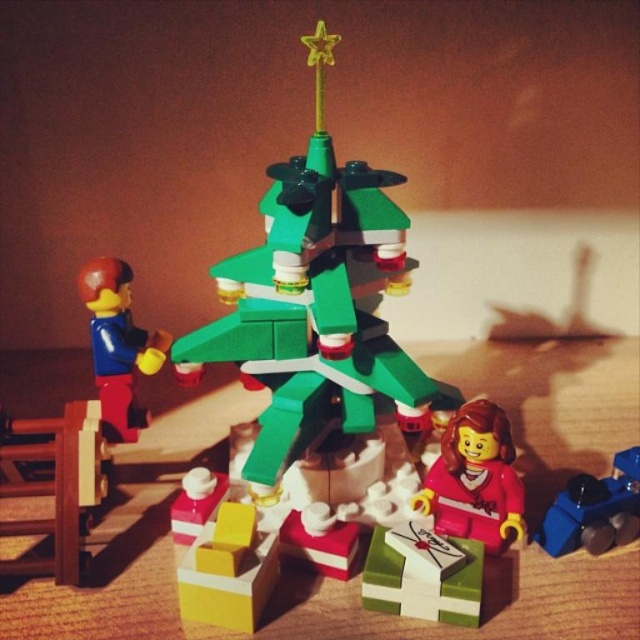
Question: Is green matte christmas tree at center bigger than smooth red minifigure at center?

Choices:
 (A) yes
 (B) no

Answer: (A)

Question: Which object is closer to the camera taking this photo?

Choices:
 (A) matte blue plastic figure at left
 (B) green matte gift at center
 (C) smooth red minifigure at center
 (D) blue plastic train at lower right

Answer: (B)

Question: Can you confirm if smooth red minifigure at center is positioned above green matte gift at center?

Choices:
 (A) yes
 (B) no

Answer: (A)

Question: In this image, where is green matte gift at center located relative to blue plastic train at lower right?

Choices:
 (A) below
 (B) above

Answer: (A)

Question: Which is farther from the smooth red minifigure at center?

Choices:
 (A) green matte gift at center
 (B) green matte christmas tree at center
 (C) matte blue plastic figure at left
 (D) blue plastic train at lower right

Answer: (C)

Question: Among these points, which one is nearest to the camera?

Choices:
 (A) (388, 230)
 (B) (445, 572)
 (C) (90, 262)
 (D) (561, 522)

Answer: (B)